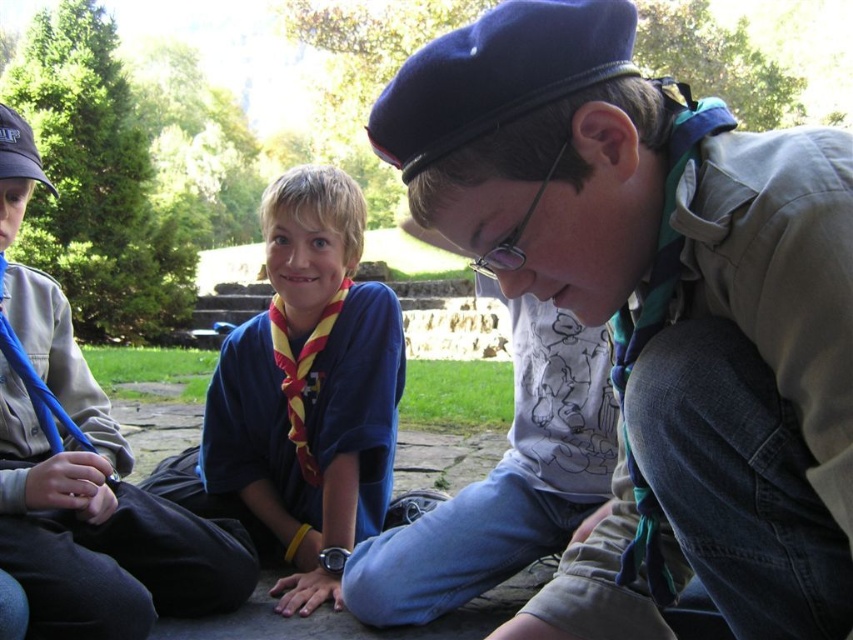
Locate an element on the screen. Image resolution: width=853 pixels, height=640 pixels. matte khaki shirt at center is located at coordinates click(x=657, y=307).

Does matte khaki shirt at center have a smaller size compared to blue fabric necktie at left?

No, matte khaki shirt at center is not smaller than blue fabric necktie at left.

Who is more forward, (718, 589) or (183, 593)?

Positioned in front is point (718, 589).

Identify the location of matte khaki shirt at center. (657, 307).

Can you confirm if matte khaki shirt at center is positioned to the right of blue/yellow scarf at center?

Yes, matte khaki shirt at center is to the right of blue/yellow scarf at center.

Is matte khaki shirt at center thinner than blue/yellow scarf at center?

Indeed, matte khaki shirt at center has a lesser width compared to blue/yellow scarf at center.

Image resolution: width=853 pixels, height=640 pixels. What do you see at coordinates (657, 307) in the screenshot? I see `matte khaki shirt at center` at bounding box center [657, 307].

You are a GUI agent. You are given a task and a screenshot of the screen. Output one action in this format:
    pyautogui.click(x=<x>, y=<y>)
    Task: Click on the matte khaki shirt at center
    The height and width of the screenshot is (640, 853).
    Given the screenshot: What is the action you would take?
    pyautogui.click(x=657, y=307)

Who is positioned more to the right, blue/yellow scarf at center or blue fabric necktie at left?

Positioned to the right is blue/yellow scarf at center.

Between blue/yellow scarf at center and blue fabric necktie at left, which one has more height?

blue/yellow scarf at center is taller.

What do you see at coordinates (302, 396) in the screenshot? I see `blue/yellow scarf at center` at bounding box center [302, 396].

At what (x,y) coordinates should I click in order to perform the action: click on blue/yellow scarf at center. Please return your answer as a coordinate pair (x, y). Looking at the image, I should click on (302, 396).